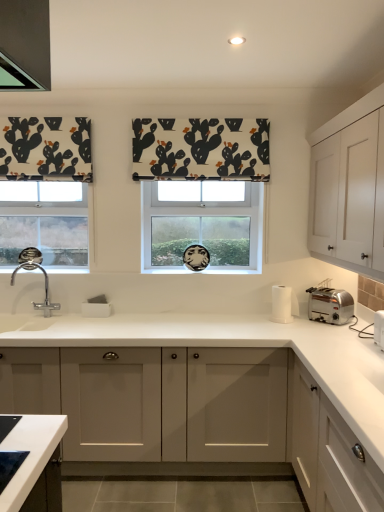
Question: Based on their sizes in the image, would you say satin silver toaster at right is bigger or smaller than white fabric with cactus print at center?

Choices:
 (A) big
 (B) small

Answer: (B)

Question: Is satin silver toaster at right inside the boundaries of white fabric with cactus print at center, or outside?

Choices:
 (A) outside
 (B) inside

Answer: (A)

Question: Which object is the farthest from the white matte cabinet at center, placed as the second cabinetry when sorted from bottom to top?

Choices:
 (A) white fabric with cactus print at center
 (B) white matte cabinet at upper right, acting as the third cabinetry starting from the bottom
 (C) silver metallic toaster at right, the second appliance when ordered from back to front
 (D) clear glass window at center
 (E) white paper towel holder at right, positioned as the 1th appliance in back-to-front order

Answer: (A)

Question: Estimate the real-world distances between objects in this image. Which object is closer to the satin silver toaster at right?

Choices:
 (A) white matte cabinet at lower right, acting as the 1th cabinetry starting from the bottom
 (B) white matte cabinet at center, placed as the second cabinetry when sorted from bottom to top
 (C) clear glass window at center
 (D) white matte cabinet at upper right, marked as the 1th cabinetry in a top-to-bottom arrangement
 (E) white fabric with cactus print at center

Answer: (D)